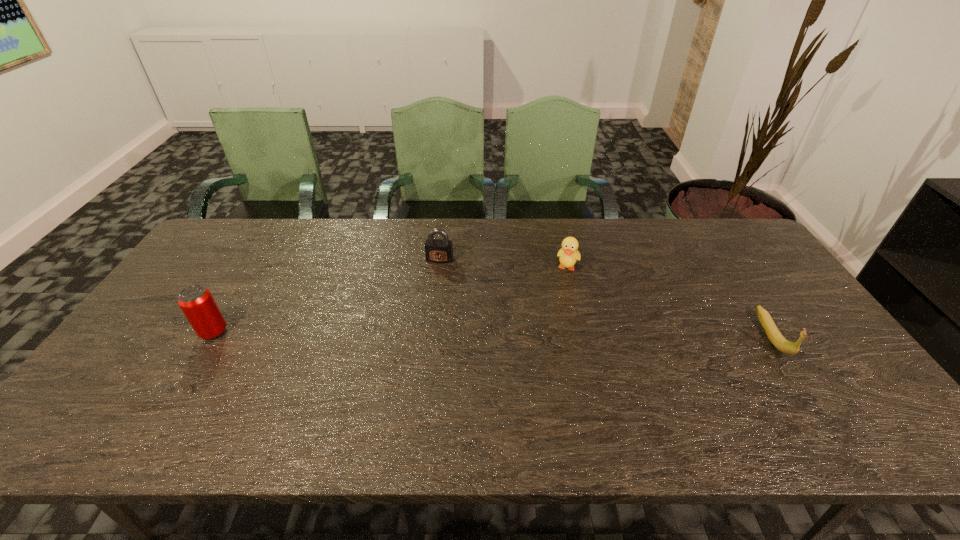
You are a GUI agent. You are given a task and a screenshot of the screen. Output one action in this format:
    pyautogui.click(x=<x>, y=<y>)
    Task: Click on the vacant space at the near left corner of the desktop
    
    Given the screenshot: What is the action you would take?
    pyautogui.click(x=157, y=393)

This screenshot has height=540, width=960. What are the coordinates of `free location at the far right corner of the desktop` in the screenshot? It's located at (719, 243).

In the image, there is a desktop. In order to click on free region at the near right corner in this screenshot , I will do `click(797, 384)`.

Image resolution: width=960 pixels, height=540 pixels. Find the location of `vacant space that's between the can and the second object from right to left`. vacant space that's between the can and the second object from right to left is located at coordinates click(391, 300).

Image resolution: width=960 pixels, height=540 pixels. Find the location of `empty space that is in between the third object from right to left and the second object from right to left`. empty space that is in between the third object from right to left and the second object from right to left is located at coordinates (504, 264).

I want to click on free space between the rightmost object and the duckling, so coord(670,302).

Locate an element on the screen. This screenshot has width=960, height=540. unoccupied position between the can and the padlock is located at coordinates (326, 296).

Locate an element on the screen. The height and width of the screenshot is (540, 960). vacant space in between the banana and the tallest object is located at coordinates (492, 334).

Where is `unoccupied area between the padlock and the third object from left to right`? The width and height of the screenshot is (960, 540). unoccupied area between the padlock and the third object from left to right is located at coordinates coord(504,264).

Identify the location of vacant space that is in between the can and the banana. The width and height of the screenshot is (960, 540). (492, 334).